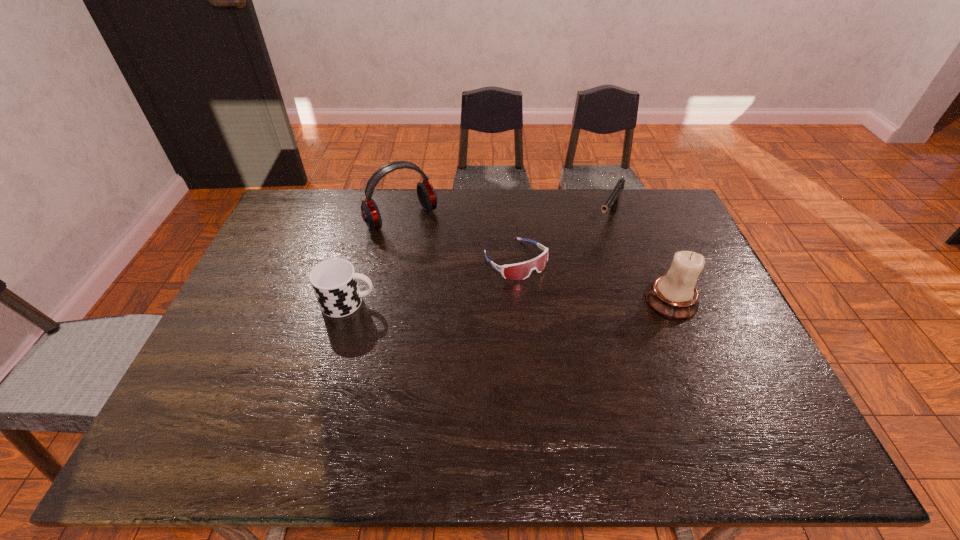
Locate an element on the screen. The height and width of the screenshot is (540, 960). empty space that is in between the pistol and the earphone is located at coordinates (505, 219).

At what (x,y) coordinates should I click in order to perform the action: click on free space between the cup and the earphone. Please return your answer as a coordinate pair (x, y). This screenshot has width=960, height=540. Looking at the image, I should click on (375, 260).

This screenshot has height=540, width=960. Find the location of `vacant region between the pistol and the cup`. vacant region between the pistol and the cup is located at coordinates (478, 261).

Image resolution: width=960 pixels, height=540 pixels. I want to click on free space that is in between the shortest object and the cup, so click(432, 281).

This screenshot has height=540, width=960. What are the coordinates of `object that is the third closest to the candle holder` in the screenshot? It's located at (426, 193).

At what (x,y) coordinates should I click in order to perform the action: click on the third closest object to the shortest object. Please return your answer as a coordinate pair (x, y). The image size is (960, 540). Looking at the image, I should click on (674, 295).

Image resolution: width=960 pixels, height=540 pixels. Identify the location of free space that satisfies the following two spatial constraints: 1. on the front side of the pistol; 2. on the right side of the earphone. (401, 219).

The height and width of the screenshot is (540, 960). Identify the location of free spot that satisfies the following two spatial constraints: 1. on the front side of the earphone; 2. on the right side of the shortest object. (394, 260).